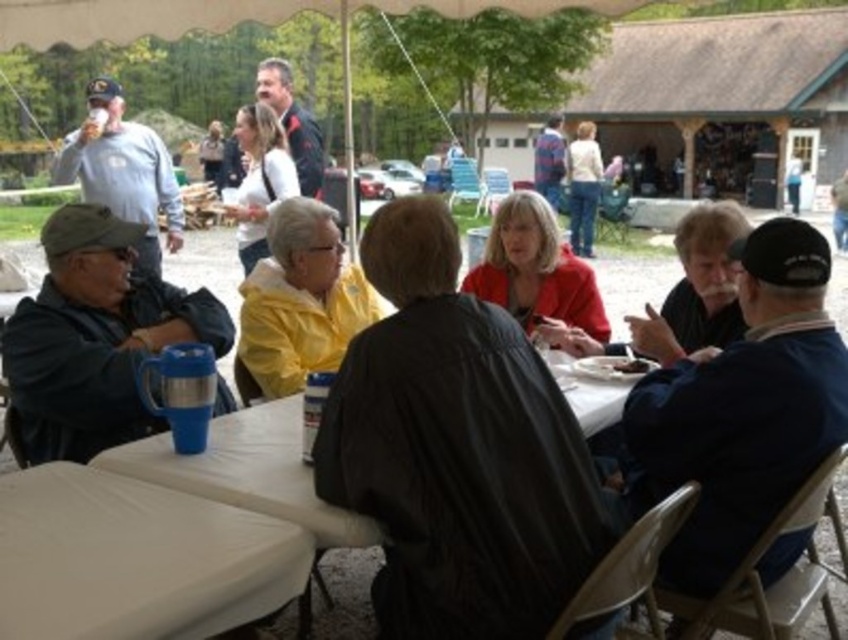
From the picture: You are standing at the entrance of the tent and want to greet both the person wearing the matte red jacket at center and the person in the light beige sweater at upper right. Which person should you approach first if you want to greet the one closer to the table?

The matte red jacket at center is positioned under light beige sweater at upper right, so the person wearing the matte red jacket at center is closer to the table. You should approach them first.

You are at the outdoor gathering and want to locate the blue fabric jacket at lower right and the light beige sweater at upper right. Which one is positioned to the left of the other?

The blue fabric jacket at lower right is to the left of the light beige sweater at upper right.